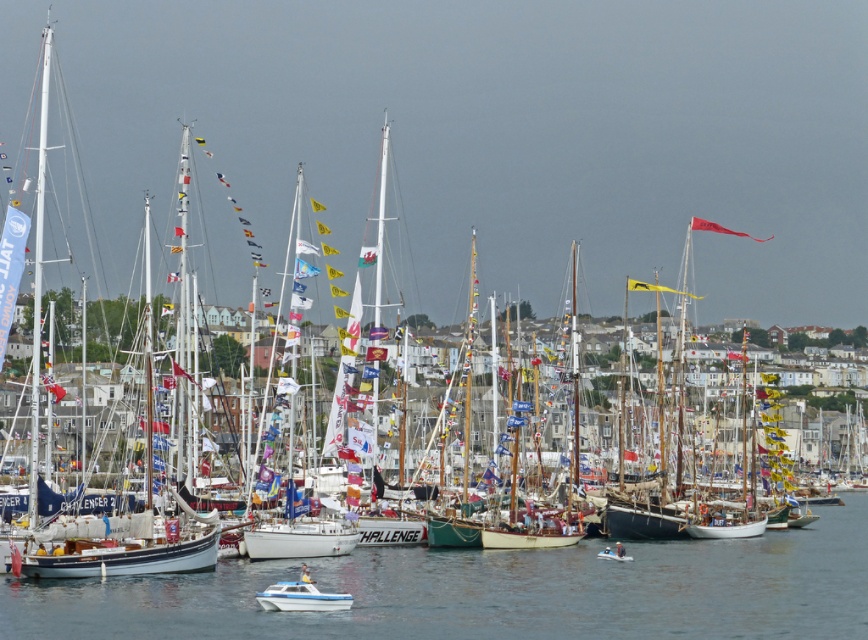
Does clear blue water at center have a smaller size compared to white glossy boat at lower center?

No.

Can you confirm if clear blue water at center is shorter than white glossy boat at lower center?

No.

Is point (621, 605) positioned after point (327, 604)?

Yes, it is behind point (327, 604).

The width and height of the screenshot is (868, 640). Identify the location of clear blue water at center. (492, 593).